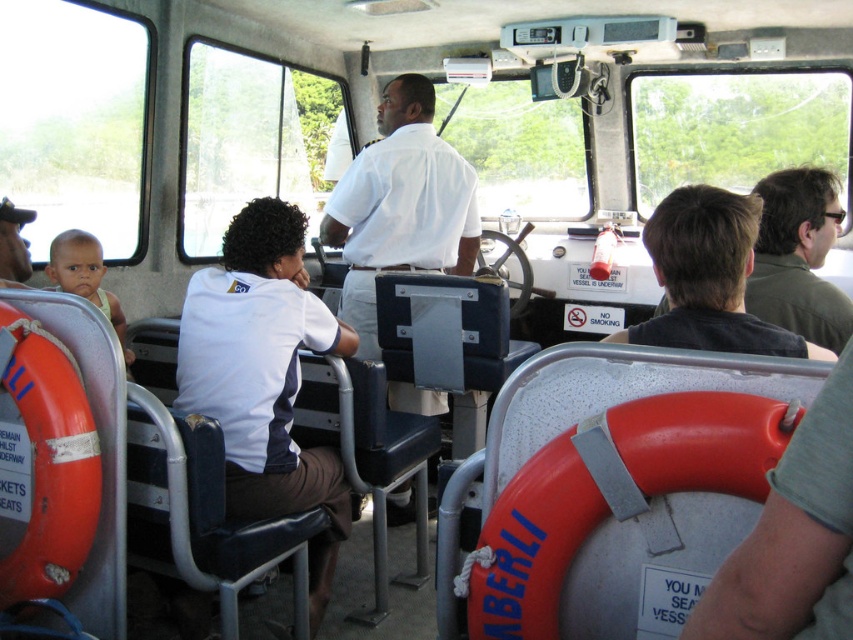
Between white matte shirt at center and light brown skin baby at left, which one appears on the left side from the viewer's perspective?

From the viewer's perspective, light brown skin baby at left appears more on the left side.

Does point (422, 168) come farther from viewer compared to point (102, 276)?

Yes, point (422, 168) is behind point (102, 276).

Where is `white matte shirt at center`? The height and width of the screenshot is (640, 853). white matte shirt at center is located at coordinates click(399, 205).

Where is `white matte shirt at center`? This screenshot has height=640, width=853. white matte shirt at center is located at coordinates (399, 205).

Between point (592, 570) and point (20, 227), which one is positioned behind?

Positioned behind is point (20, 227).

Does orange rubber life preserver at lower right appear on the right side of matte black shirt at left?

Indeed, orange rubber life preserver at lower right is positioned on the right side of matte black shirt at left.

Is point (625, 497) more distant than point (27, 266)?

No, (625, 497) is closer to viewer.

The height and width of the screenshot is (640, 853). In order to click on orange rubber life preserver at lower right in this screenshot , I will do `click(625, 516)`.

Can you confirm if white fabric shirt at center is positioned to the right of light brown skin baby at left?

Indeed, white fabric shirt at center is positioned on the right side of light brown skin baby at left.

Which is behind, point (308, 336) or point (94, 282)?

Point (94, 282)

Between point (231, 253) and point (84, 292), which one is positioned in front?

Point (231, 253)

Image resolution: width=853 pixels, height=640 pixels. I want to click on white fabric shirt at center, so click(x=264, y=378).